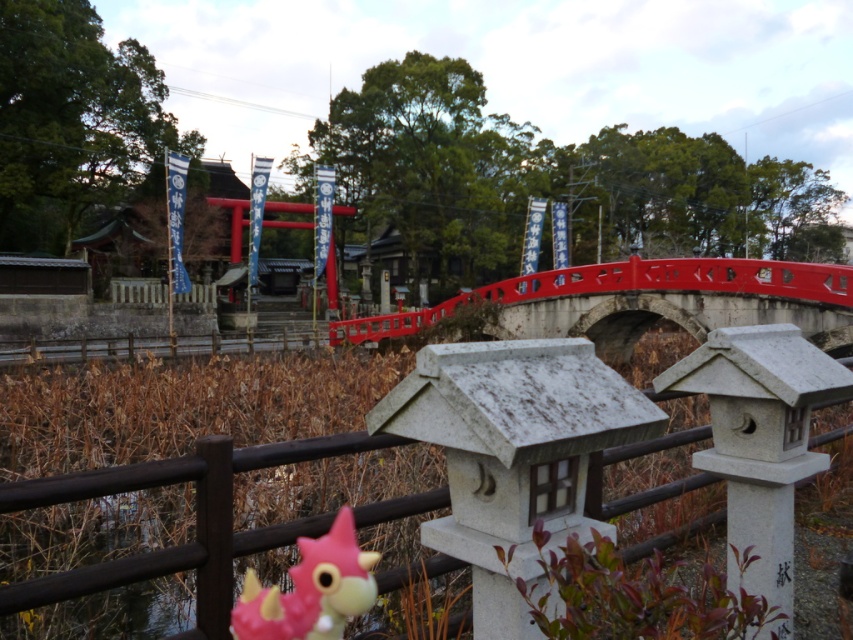
What do you see at coordinates (643, 301) in the screenshot? I see `smooth stone bridge at center` at bounding box center [643, 301].

Is point (741, 260) positioned behind point (421, 497)?

Yes, point (741, 260) is behind point (421, 497).

Locate an element on the screen. The image size is (853, 640). smooth stone bridge at center is located at coordinates (643, 301).

From the picture: Does smooth stone bridge at center have a greater width compared to pink matte toy at center?

Yes, smooth stone bridge at center is wider than pink matte toy at center.

Is smooth stone bridge at center above pink matte toy at center?

Correct, smooth stone bridge at center is located above pink matte toy at center.

Does point (670, 276) come closer to viewer compared to point (355, 547)?

No, (670, 276) is behind (355, 547).

The width and height of the screenshot is (853, 640). Identify the location of smooth stone bridge at center. (643, 301).

Is the position of brown wooden fence at lower center more distant than that of pink matte toy at center?

No, brown wooden fence at lower center is closer to the viewer.

Where is `brown wooden fence at lower center`? The height and width of the screenshot is (640, 853). brown wooden fence at lower center is located at coordinates (195, 524).